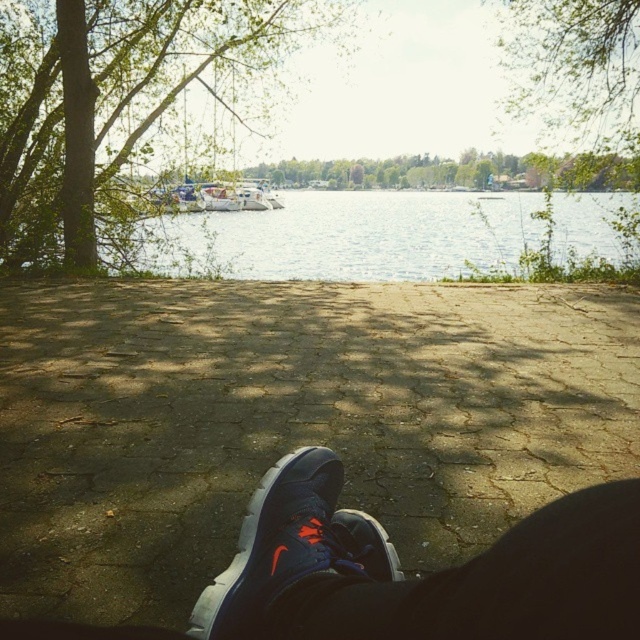
The image size is (640, 640). What do you see at coordinates (118, 104) in the screenshot? I see `green leafy tree at upper left` at bounding box center [118, 104].

From the picture: Can you confirm if green leafy tree at upper left is thinner than matte blue sneaker at lower center?

Indeed, green leafy tree at upper left has a lesser width compared to matte blue sneaker at lower center.

Is point (60, 125) in front of point (294, 460)?

No, (60, 125) is behind (294, 460).

You are a GUI agent. You are given a task and a screenshot of the screen. Output one action in this format:
    pyautogui.click(x=<x>, y=<y>)
    Task: Click on the green leafy tree at upper left
    The image size is (640, 640).
    Given the screenshot: What is the action you would take?
    pyautogui.click(x=118, y=104)

What do you see at coordinates (118, 104) in the screenshot? I see `green leafy tree at upper left` at bounding box center [118, 104].

Which is behind, point (1, 61) or point (419, 193)?

Positioned behind is point (419, 193).

Find the location of a particular element. This screenshot has width=640, height=640. green leafy tree at upper left is located at coordinates (118, 104).

Is green leafy tree at upper left wider than green leafy tree at upper center?

Incorrect, green leafy tree at upper left's width does not surpass green leafy tree at upper center's.

Is green leafy tree at upper left positioned behind green leafy tree at upper center?

Yes.

Locate an element on the screen. The width and height of the screenshot is (640, 640). green leafy tree at upper left is located at coordinates (118, 104).